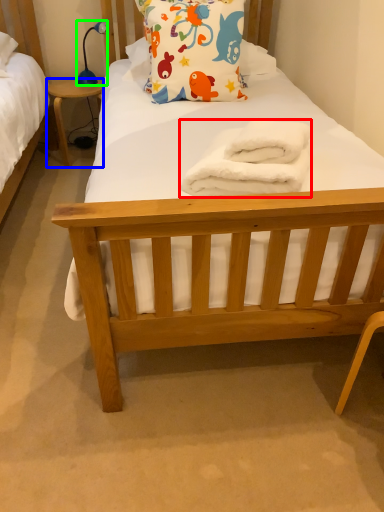
Question: Based on their relative distances, which object is farther from towel/napkin (highlighted by a red box)? Choose from desk (highlighted by a blue box) and lamp (highlighted by a green box).

Choices:
 (A) desk
 (B) lamp

Answer: (B)